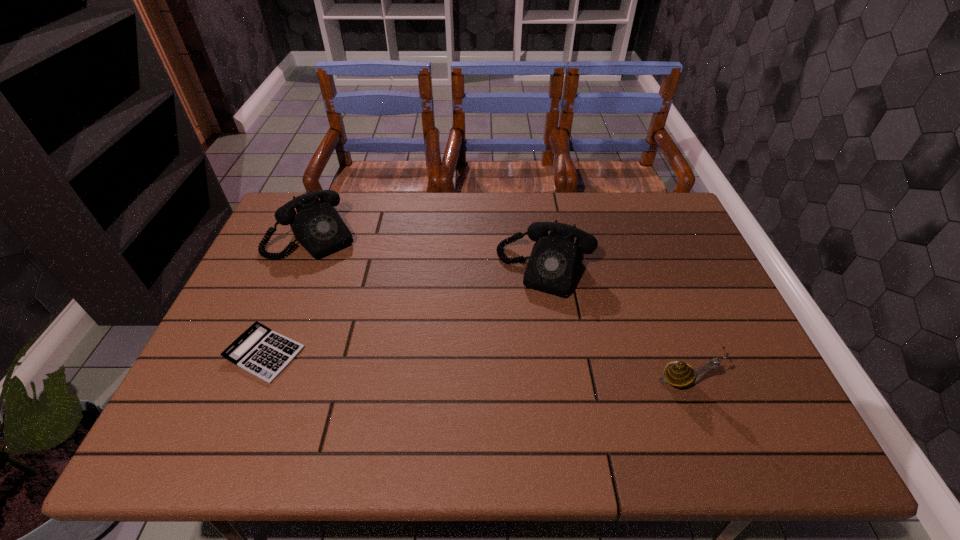
Where is `object present at the near right corner`? object present at the near right corner is located at coordinates (679, 374).

Locate an element on the screen. The width and height of the screenshot is (960, 540). vacant space at the far edge of the desktop is located at coordinates (485, 234).

The image size is (960, 540). I want to click on blank area at the near edge, so [438, 379].

In the image, there is a desktop. Where is `free space at the left edge`? free space at the left edge is located at coordinates (232, 340).

In the image, there is a desktop. Where is `free space at the right edge`? free space at the right edge is located at coordinates (682, 299).

Identify the location of free location at the far left corner of the desktop. (292, 199).

In the image, there is a desktop. Where is `free space at the far right corner`? free space at the far right corner is located at coordinates pos(637,225).

At what (x,y) coordinates should I click in order to perform the action: click on vacant region at the near right corner of the desktop. Please return your answer as a coordinate pair (x, y). The image size is (960, 540). Looking at the image, I should click on (731, 397).

Where is `free spot between the shortest object and the second object from right to left`? free spot between the shortest object and the second object from right to left is located at coordinates (405, 312).

This screenshot has width=960, height=540. I want to click on free point between the snail and the shortest object, so click(x=474, y=367).